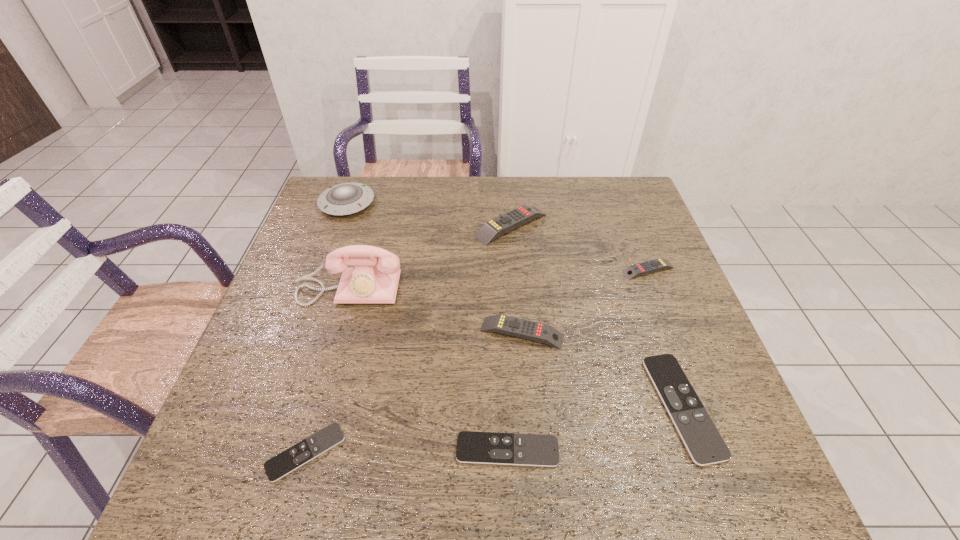
The height and width of the screenshot is (540, 960). I want to click on remote control that stands as the third closest to the second biggest black remote control, so click(x=306, y=450).

This screenshot has height=540, width=960. Find the location of `yellow remote control that is the third closest one to the second tallest object`. yellow remote control that is the third closest one to the second tallest object is located at coordinates (631, 272).

You are a GUI agent. You are given a task and a screenshot of the screen. Output one action in this format:
    pyautogui.click(x=<x>, y=<y>)
    Task: Click on the yellow remote control that stands as the third closest to the saucer
    The height and width of the screenshot is (540, 960).
    Given the screenshot: What is the action you would take?
    [631, 272]

Identify which black remote control is the second closest to the leftmost black remote control. Please provide its 2D coordinates. Your answer should be formatted as a tuple, i.e. [(x, y)], where the tuple contains the x and y coordinates of a point satisfying the conditions above.

[(700, 436)]

Locate which black remote control ranks in proximity to the second nearest yellow remote control. Please provide its 2D coordinates. Your answer should be formatted as a tuple, i.e. [(x, y)], where the tuple contains the x and y coordinates of a point satisfying the conditions above.

[(700, 436)]

Where is `vacant area in the image that satisfies the following two spatial constraints: 1. on the dial of the shortest object; 2. on the left side of the pink telephone`? vacant area in the image that satisfies the following two spatial constraints: 1. on the dial of the shortest object; 2. on the left side of the pink telephone is located at coordinates (302, 452).

This screenshot has height=540, width=960. I want to click on vacant space that satisfies the following two spatial constraints: 1. on the front side of the fourth tallest remote control; 2. on the left side of the fifth farthest object, so click(x=528, y=407).